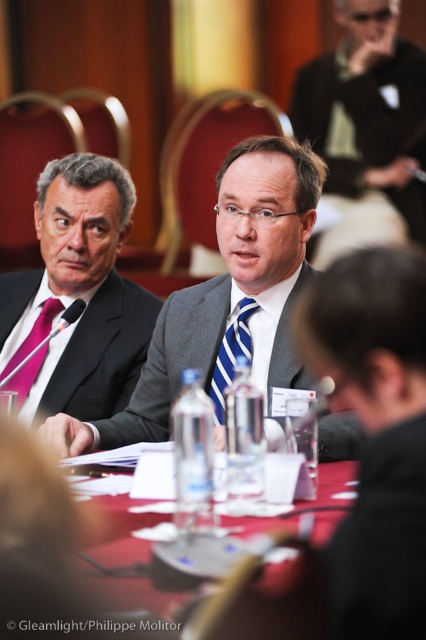
You are a photographer setting up for a photo shoot in the conference room. You need to ensure that the smooth plastic water bottle at center and the blue striped tie at center are both visible in the frame. Given that your camera has a maximum focus range of 25 inches, will you be able to capture both objects clearly in the same photo?

The smooth plastic water bottle at center is 27.57 inches away from the blue striped tie at center. Since the distance between them exceeds the camera maximum focus range of 25 inches, you might not be able to capture both objects clearly in the same photo.

You are standing at the back of the conference room and want to walk to the point that is closer to the front. Which point should you go to, point (242, 188) or point (77, 292)?

Point (242, 188) is in front of point (77, 292), so you should go to point (242, 188) to reach the closer one to the front.

You are an event planner organizing a conference. You need to ensure that the microphone on the table is accessible to both the gray suit at center and the blue striped tie at center. Based on their positions, which one is closer to the microphone?

The gray suit at center is located above the blue striped tie at center, so the blue striped tie at center is closer to the microphone on the table.